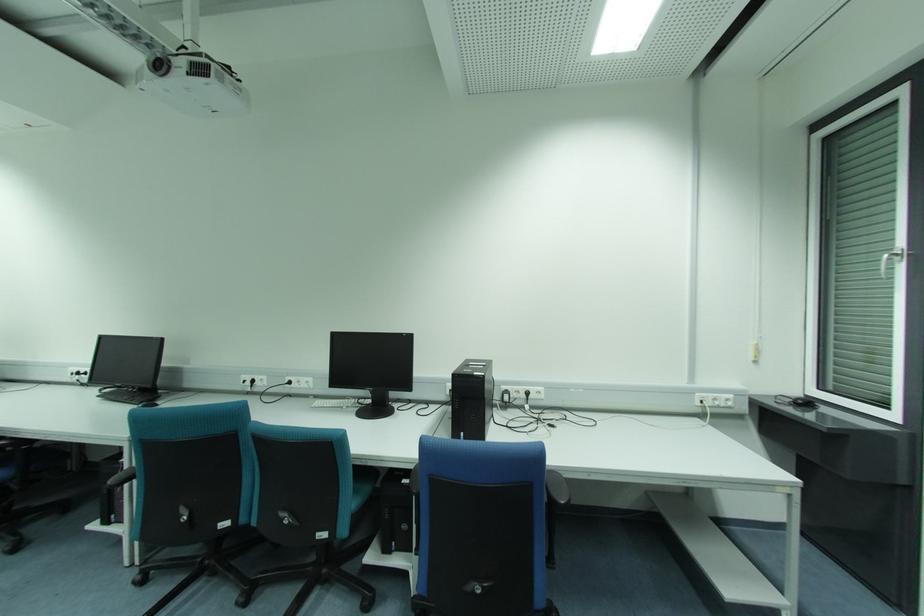
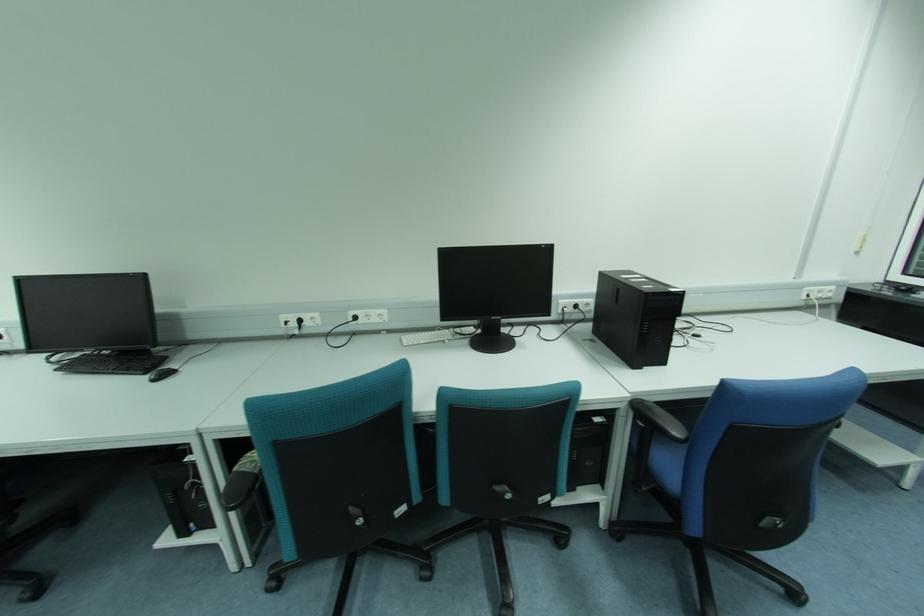
In the second image, find the point that corresponds to pixel 265 383 in the first image.

(319, 322)